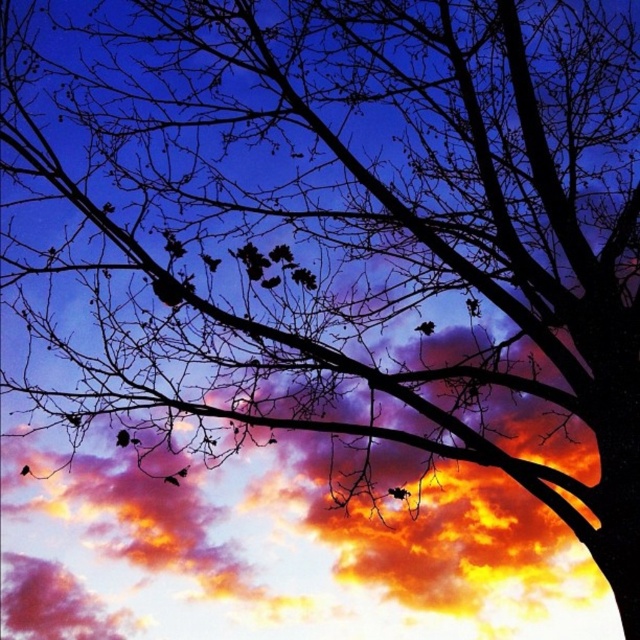
You are a birdwatcher trying to capture a photo of the black matte bird at center and the silhouette feather at lower left in the same frame. Given that your camera has a maximum focus range of 6 feet, will you be able to capture both subjects clearly in one shot?

The distance between the black matte bird at center and the silhouette feather at lower left is 6.06 feet, which exceeds the camera focus range of 6 feet. Therefore, you cannot capture both subjects clearly in one shot.

You are an astronomer analyzing the image of the tree silhouette against the sky. You have two points marked in the image, point A at coordinates point A is point (x=428, y=333) and point B at coordinates point B is point (x=26, y=465). Based on their positions, which point is closer to the horizon?

Point B at coordinates point (x=26, y=465) is closer to the horizon because it has a lower y coordinate value compared to point A at coordinates point (x=428, y=333).

You are standing in front of the tree and want to take a photo of the point at coordinates point (x=432, y=330). If your camera has a focal length of 50mm and you are currently 10 meters away from the point, should you move closer or farther away to focus on it properly?

The point (x=432, y=330) is 4.51 meters away from the camera. Since you are currently 10 meters away from the point, you need to move closer to reduce the distance to the recommended 4.51 meters for proper focus.